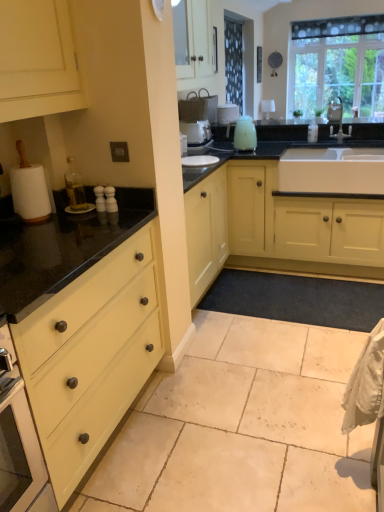
At what (x,y) coordinates should I click in order to perform the action: click on free space above beige tile floor at lower center (from a real-world perspective). Please return your answer as a coordinate pair (x, y). This screenshot has height=512, width=384. Looking at the image, I should click on (229, 436).